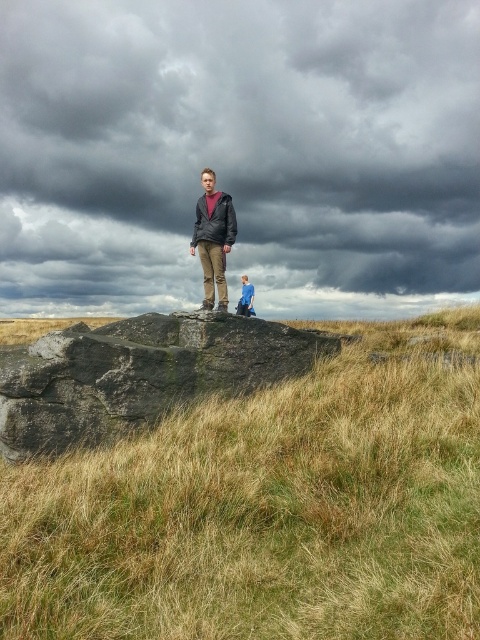
From the picture: You are a hiker who wants to place a marker at the exact midpoint between the brown dry grass at center and the dark gray stone boulder at center. Based on the scene, can you determine which object the marker will be closer to?

The brown dry grass at center is positioned on the right side of dark gray stone boulder at center, so the midpoint between them would be closer to the dark gray stone boulder at center since the grass is to its right.